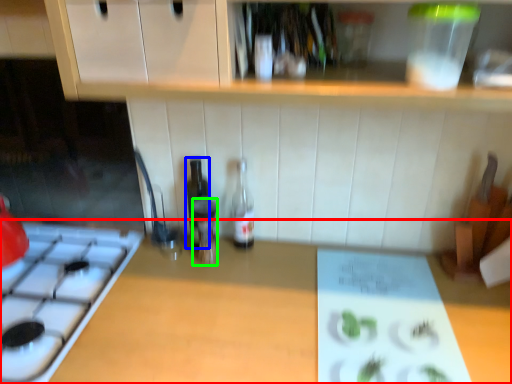
Question: Which object is the closest to the countertop (highlighted by a red box)? Choose among these: bottle (highlighted by a blue box) or bottle (highlighted by a green box).

Choices:
 (A) bottle
 (B) bottle

Answer: (B)